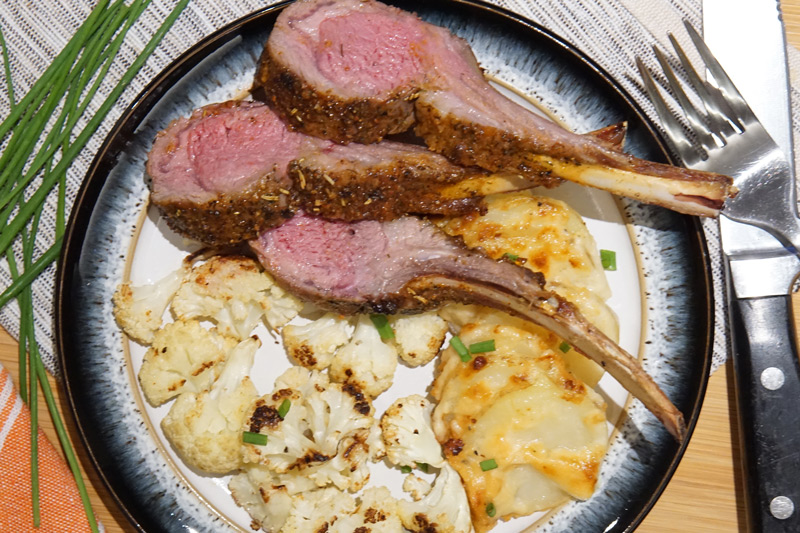
The image size is (800, 533). I want to click on plate, so click(545, 80).